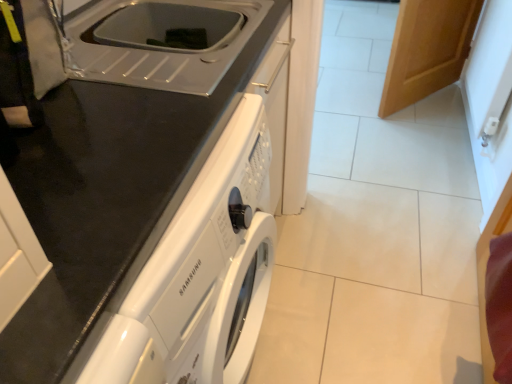
Locate an element on the screen. This screenshot has width=512, height=384. vacant area to the left of wooden door at upper right is located at coordinates (351, 102).